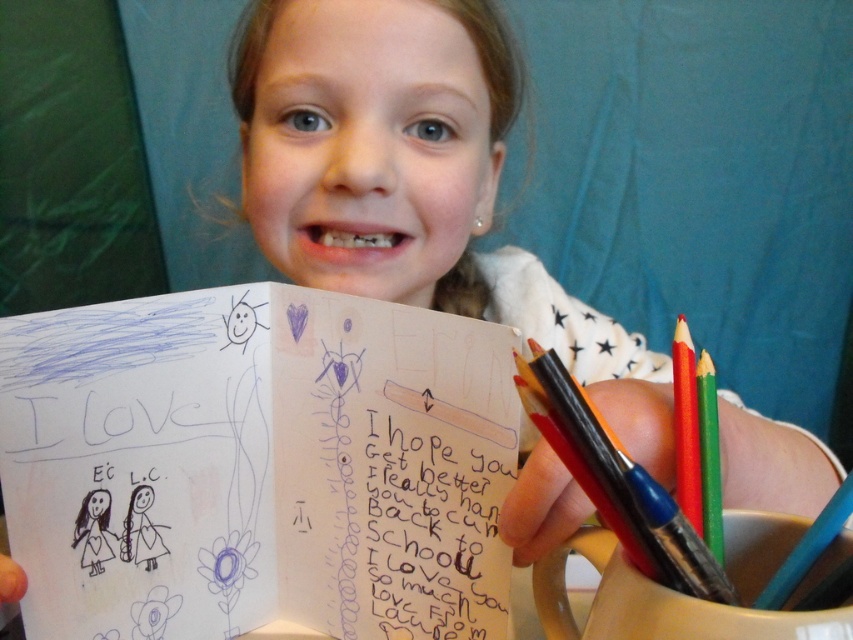
Question: Estimate the real-world distances between objects in this image. Which object is farther from the matte black pencil at right?

Choices:
 (A) handwritten paper at center
 (B) white paper notebook at center

Answer: (B)

Question: Which point is farther to the camera?

Choices:
 (A) handwritten paper at center
 (B) white paper notebook at center

Answer: (A)

Question: Is handwritten paper at center above green matte crayon at right?

Choices:
 (A) no
 (B) yes

Answer: (A)

Question: Considering the real-world distances, which object is farthest from the matte black pencil at right?

Choices:
 (A) handwritten paper at center
 (B) red matte pencil at right
 (C) white paper notebook at center
 (D) green matte crayon at right

Answer: (C)

Question: Does handwritten paper at center lie behind green matte crayon at right?

Choices:
 (A) yes
 (B) no

Answer: (A)

Question: Does white paper notebook at center have a lesser width compared to handwritten paper at center?

Choices:
 (A) yes
 (B) no

Answer: (B)